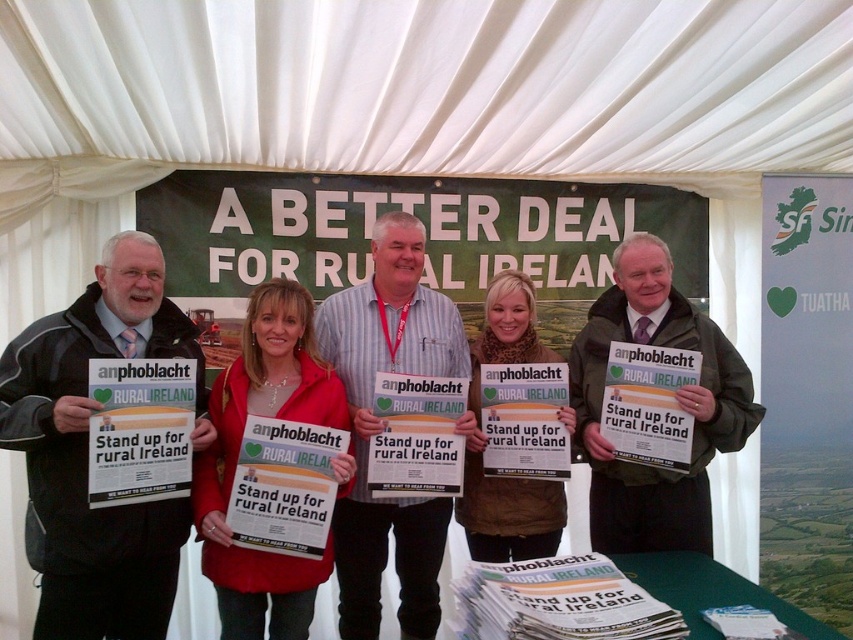
Does red jacket at center have a larger size compared to brown woolen scarf at center?

Yes, red jacket at center is bigger than brown woolen scarf at center.

Does point (260, 406) lie in front of point (479, 358)?

Yes, it is.

I want to click on red jacket at center, so click(x=236, y=458).

Who is more distant from viewer, [444,320] or [346,470]?

The point [444,320] is more distant.

Locate an element on the screen. striped shirt at center is located at coordinates (384, 426).

Does point (410, 636) come in front of point (706, 401)?

That is False.

Who is lower down, striped shirt at center or green fabric jacket at center?

striped shirt at center is below.

Which is in front, point (440, 300) or point (663, 310)?

Positioned in front is point (663, 310).

Where is `striped shirt at center`? The image size is (853, 640). striped shirt at center is located at coordinates (384, 426).